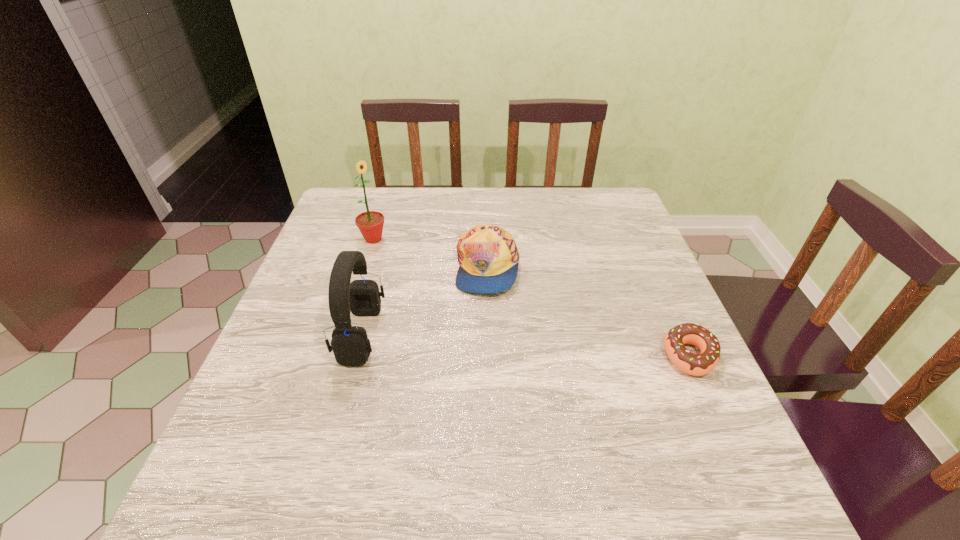
You are a GUI agent. You are given a task and a screenshot of the screen. Output one action in this format:
    pyautogui.click(x=<x>, y=<y>)
    Task: Click on the headset
    
    Given the screenshot: What is the action you would take?
    pyautogui.click(x=350, y=344)

In order to click on the rightmost object in this screenshot , I will do `click(701, 364)`.

Identify the location of the shortest object. (701, 364).

Where is `the tallest object`? This screenshot has height=540, width=960. the tallest object is located at coordinates coord(370,223).

At what (x,y) coordinates should I click in order to perform the action: click on the second object from right to left. Please return your answer as a coordinate pair (x, y). Looking at the image, I should click on (488, 256).

Find the location of a particular element. The image size is (960, 540). the third tallest object is located at coordinates (488, 256).

Identify the location of vacant area situated 0.170m on the headband of the third shortest object. (459, 334).

Identify the location of free space located 0.120m on the back of the shortest object. (663, 298).

At what (x,y) coordinates should I click in order to perform the action: click on free space located 0.390m on the face of the tallest object. Please return your answer as a coordinate pair (x, y). This screenshot has height=540, width=960. Looking at the image, I should click on (467, 328).

Find the location of `free spot located on the face of the tallest object`. free spot located on the face of the tallest object is located at coordinates (441, 303).